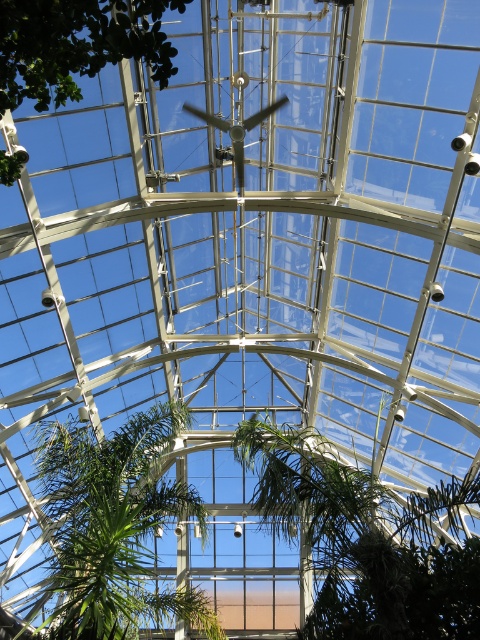
Which of these two, green leafy tree at center or green leafy plant at center, stands taller?

With more height is green leafy plant at center.

Who is more forward, (354, 547) or (109, 628)?

Point (109, 628) is in front.

Is point (377, 557) positioned behind point (116, 461)?

No, (377, 557) is closer to viewer.

Find the location of a particular element. The width and height of the screenshot is (480, 640). green leafy tree at center is located at coordinates point(365,541).

Is green leafy plant at center shorter than green leafy tree at upper center?

No, green leafy plant at center is not shorter than green leafy tree at upper center.

Who is shorter, green leafy plant at center or green leafy tree at upper center?

Standing shorter between the two is green leafy tree at upper center.

Which is behind, point (156, 593) or point (143, 29)?

Positioned behind is point (156, 593).

Identify the location of green leafy plant at center. (113, 528).

Based on the photo, can you confirm if green leafy tree at center is positioned to the right of green leafy tree at upper center?

Indeed, green leafy tree at center is positioned on the right side of green leafy tree at upper center.

Is green leafy tree at center behind green leafy tree at upper center?

Yes, it is.

Is point (398, 624) positioned after point (148, 54)?

Yes, point (398, 624) is farther from viewer.

I want to click on green leafy tree at center, so click(x=365, y=541).